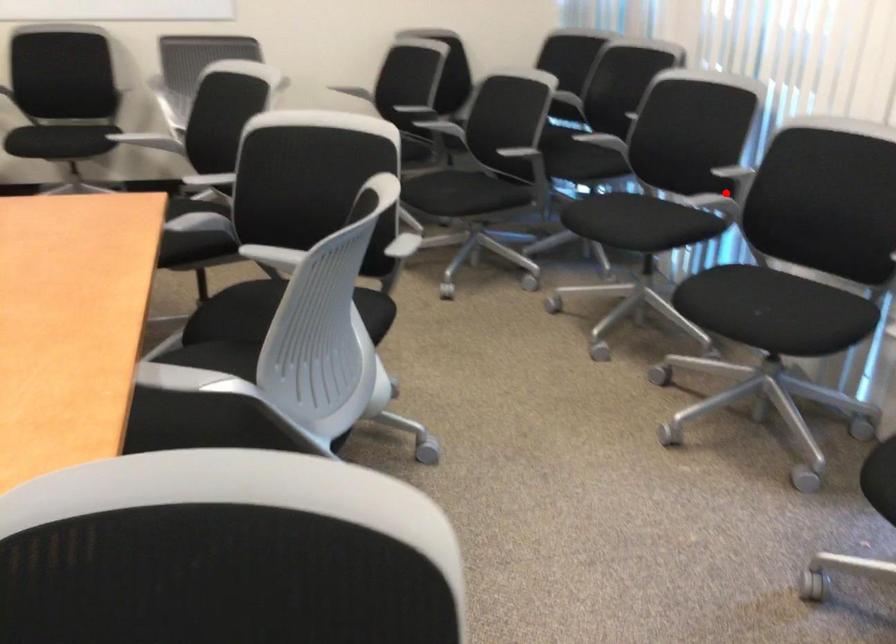
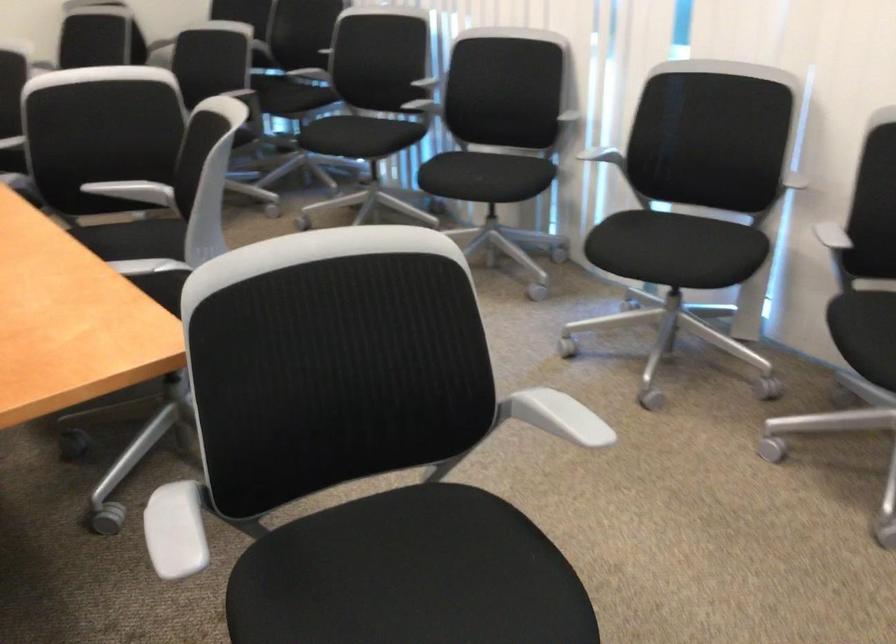
Question: I am providing you with two images of the same scene from different viewpoints. A red point is marked on the first image. At the location where the point appears in image 1, is it still visible in image 2?

Choices:
 (A) Yes
 (B) No

Answer: (B)